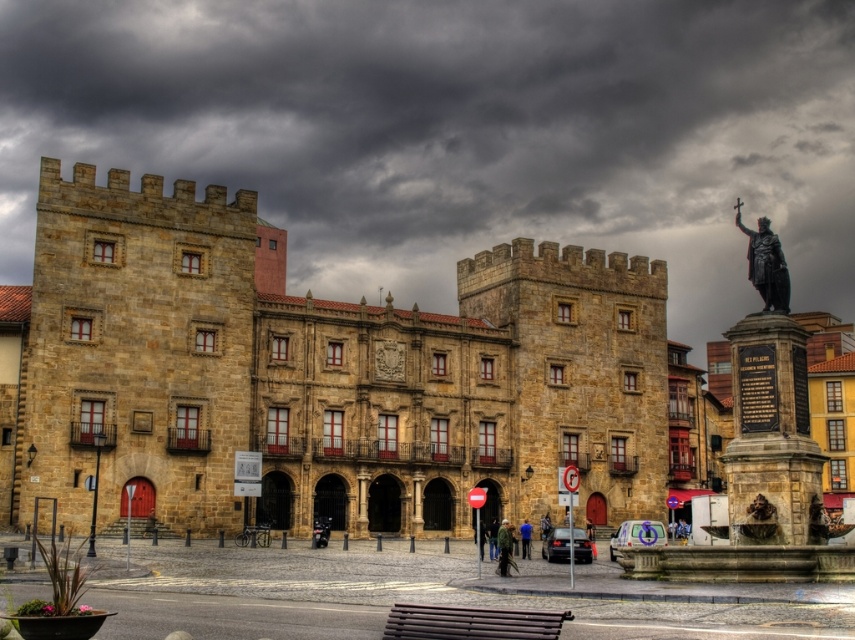
You are an architect examining the brown stone castle at center and the polished bronze statue at center right in the image. Which structure appears larger in the scene?

The polished bronze statue at center right appears larger than the brown stone castle at center in the scene.

You are a tourist standing in front of the brown stone castle at center and the polished bronze statue at center right. Which object is closer to you?

The brown stone castle at center is closer to you because the polished bronze statue at center right is behind it.

You are an artist planning to sketch the scene in front of you. You notice the brown stone castle at center and the blue fabric jacket at center. Which object should you focus on first if you want to draw the larger object first?

The brown stone castle at center is larger in size than the blue fabric jacket at center, so you should focus on drawing the brown stone castle at center first.